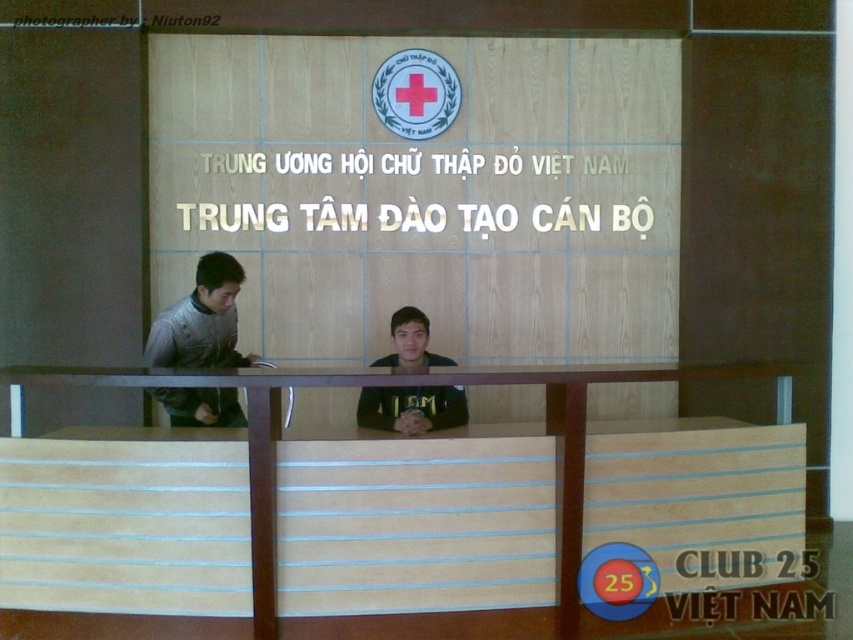
Question: Does gray matte jacket at left appear on the left side of black matte shirt at center?

Choices:
 (A) yes
 (B) no

Answer: (A)

Question: Which point is farther from the camera taking this photo?

Choices:
 (A) (173, 326)
 (B) (556, 436)

Answer: (A)

Question: Which object is closer to the camera taking this photo?

Choices:
 (A) black matte shirt at center
 (B) gray matte jacket at left

Answer: (A)

Question: Which object appears farthest from the camera in this image?

Choices:
 (A) gray matte jacket at left
 (B) black matte shirt at center

Answer: (A)

Question: Does light brown wood table at center appear on the left side of gray matte jacket at left?

Choices:
 (A) yes
 (B) no

Answer: (B)

Question: Can you confirm if light brown wood table at center is wider than black matte shirt at center?

Choices:
 (A) no
 (B) yes

Answer: (B)